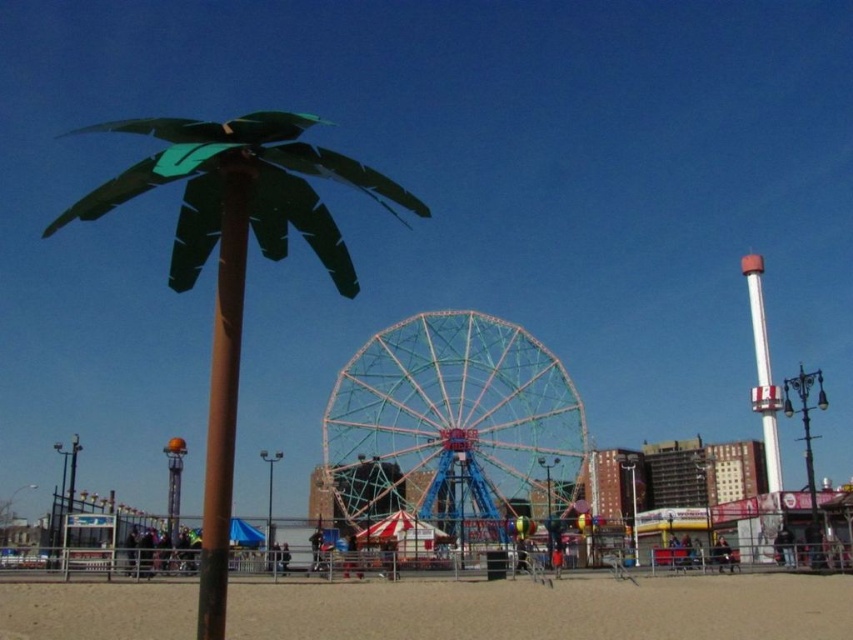
Looking at this image, does metallic blue ferris wheel at center have a greater height compared to white glossy pole at right?

Incorrect, metallic blue ferris wheel at center's height is not larger of white glossy pole at right's.

Consider the image. How much distance is there between metallic blue ferris wheel at center and white glossy pole at right?

metallic blue ferris wheel at center and white glossy pole at right are 43.65 meters apart.

Where is `metallic blue ferris wheel at center`? This screenshot has height=640, width=853. metallic blue ferris wheel at center is located at coordinates pos(451,426).

Which of these two, metallic blue ferris wheel at center or brown matte pole at center, stands taller?

Standing taller between the two is brown matte pole at center.

At what (x,y) coordinates should I click in order to perform the action: click on metallic blue ferris wheel at center. Please return your answer as a coordinate pair (x, y). The width and height of the screenshot is (853, 640). Looking at the image, I should click on (451, 426).

The width and height of the screenshot is (853, 640). I want to click on metallic blue ferris wheel at center, so click(451, 426).

Can you confirm if metallic green palm tree at left is positioned to the right of brown matte pole at center?

Indeed, metallic green palm tree at left is positioned on the right side of brown matte pole at center.

Does metallic green palm tree at left have a greater width compared to brown matte pole at center?

Yes, metallic green palm tree at left is wider than brown matte pole at center.

Does point (221, 541) come behind point (233, 408)?

No.

At what (x,y) coordinates should I click in order to perform the action: click on metallic green palm tree at left. Please return your answer as a coordinate pair (x, y). The height and width of the screenshot is (640, 853). Looking at the image, I should click on (235, 257).